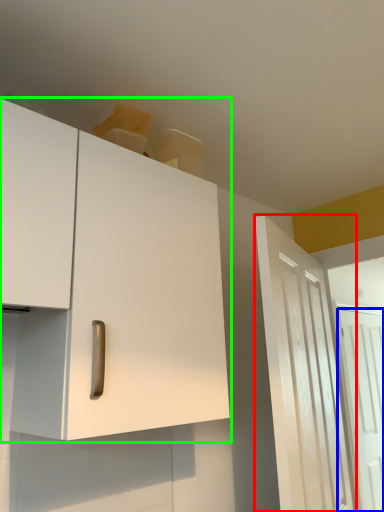
Question: Which is farther away from door (highlighted by a red box)? door (highlighted by a blue box) or cabinetry (highlighted by a green box)?

Choices:
 (A) door
 (B) cabinetry

Answer: (A)